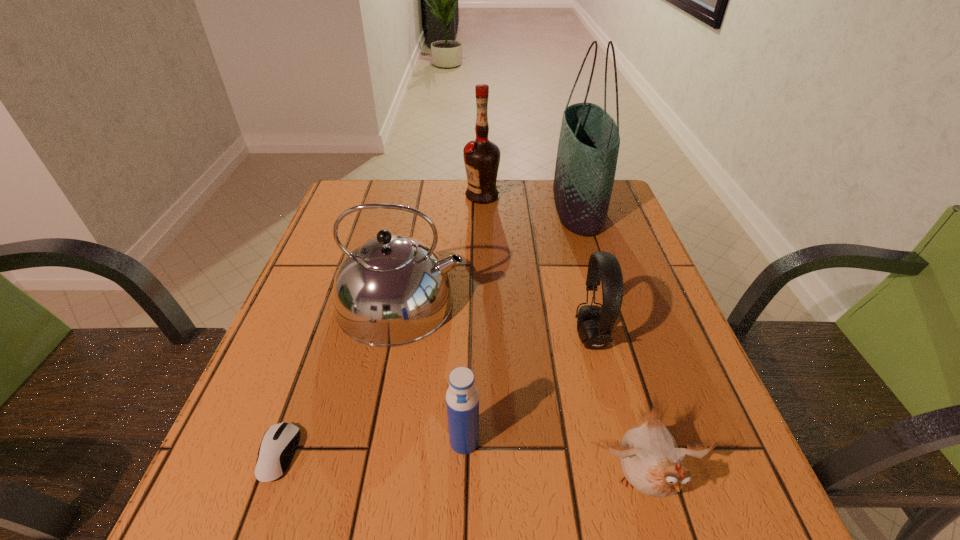
The height and width of the screenshot is (540, 960). I want to click on the tallest object, so click(x=589, y=140).

You are a GUI agent. You are given a task and a screenshot of the screen. Output one action in this format:
    pyautogui.click(x=<x>, y=<y>)
    Task: Click on the liquor
    This screenshot has height=540, width=960.
    Given the screenshot: What is the action you would take?
    pyautogui.click(x=481, y=157)

Locate an element on the screen. The height and width of the screenshot is (540, 960). the fifth shortest object is located at coordinates (392, 290).

Where is `headset`? The width and height of the screenshot is (960, 540). headset is located at coordinates (594, 323).

The height and width of the screenshot is (540, 960). What are the coordinates of `water bottle` in the screenshot? It's located at (462, 398).

The width and height of the screenshot is (960, 540). What are the coordinates of `bird` in the screenshot? It's located at (652, 463).

At what (x,y) coordinates should I click in order to perform the action: click on the shortest object. Please return your answer as a coordinate pair (x, y). The width and height of the screenshot is (960, 540). Looking at the image, I should click on (280, 441).

Image resolution: width=960 pixels, height=540 pixels. Identify the location of free space located 0.390m on the left of the tallest object. (417, 207).

The width and height of the screenshot is (960, 540). What are the coordinates of `vacant space located on the front and back of the sixth shortest object` in the screenshot? It's located at (355, 196).

The image size is (960, 540). Find the location of `vacant position located 0.340m on the front and back of the sixth shortest object`. vacant position located 0.340m on the front and back of the sixth shortest object is located at coordinates (348, 196).